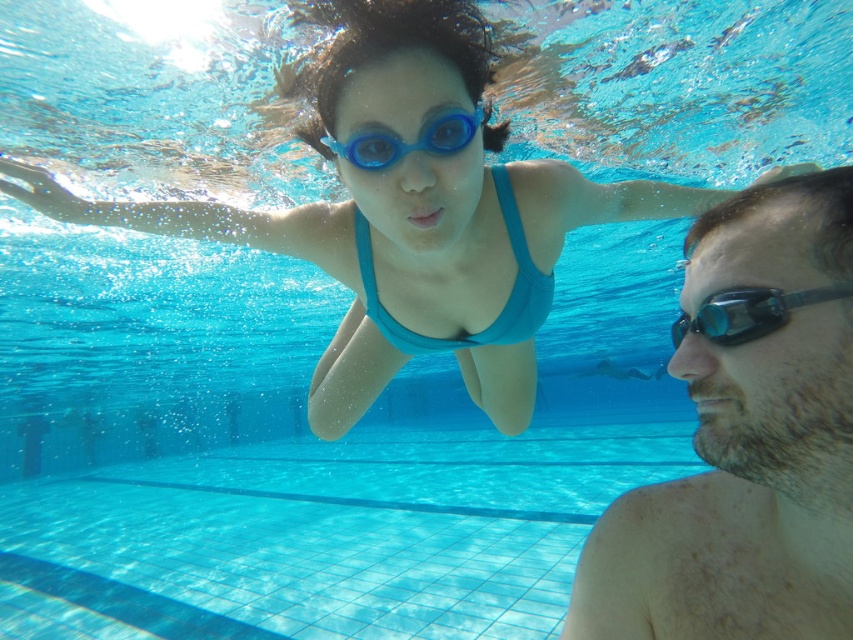
Based on the photo, you are a photographer taking a photo of the smooth skin face at right in the underwater scene. To ensure the face is centered in your shot, where should you aim your camera? Please provide coordinates as a point in the form of a tuple like this example format for your answer, e.g., the point is at approximately 0.684, 0.876. The answer should be in the same format as the example, but without the explanation. The question must not mention coordinates or the example format.

The smooth skin face at right is located at coordinates approximately (746, 436).

You are a lifeguard trying to identify the goggles worn by the swimmers in the pool. Which pair of goggles, the transparent rubber goggles at right or the blue rubber goggles at center, is bigger in size?

The transparent rubber goggles at right has a larger size compared to the blue rubber goggles at center.

You are a lifeguard trying to determine the visibility of objects in the pool. Which object, the teal fabric bikini top at center or the blue rubber goggles at center, would be more noticeable from above the water due to its size?

The teal fabric bikini top at center has a larger size compared to the blue rubber goggles at center, so it would be more noticeable from above the water.